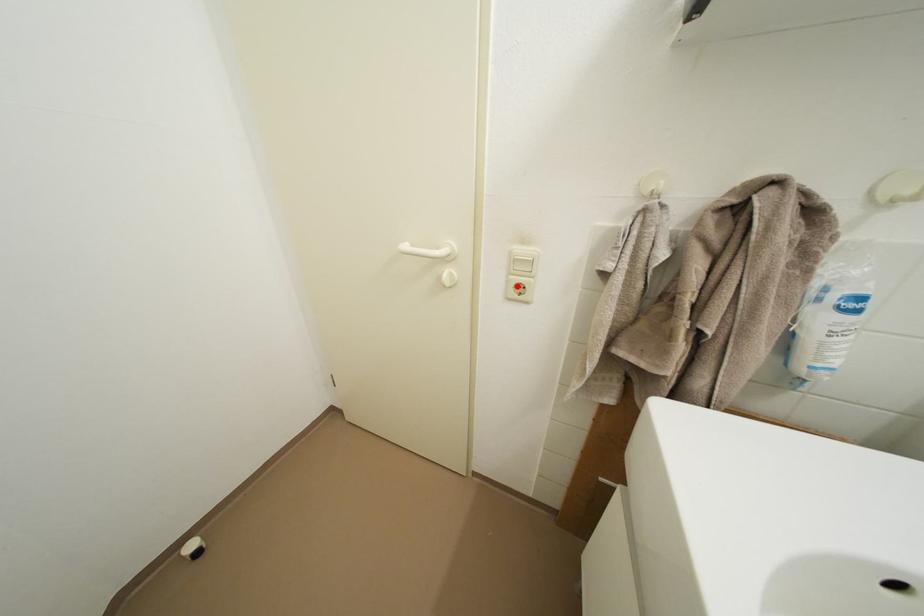
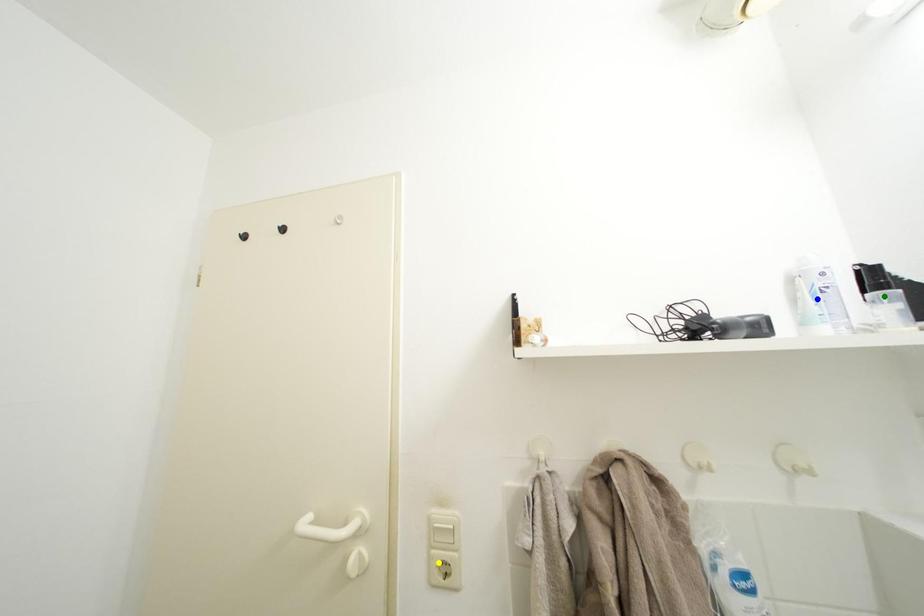
Question: I am providing you with two images of the same scene from different viewpoints. A red point is marked on the first image. You are given multiple points on the second image. In image 2, which mark is for the same physical point as the one in image 1?

Choices:
 (A) yellow point
 (B) blue point
 (C) green point

Answer: (A)